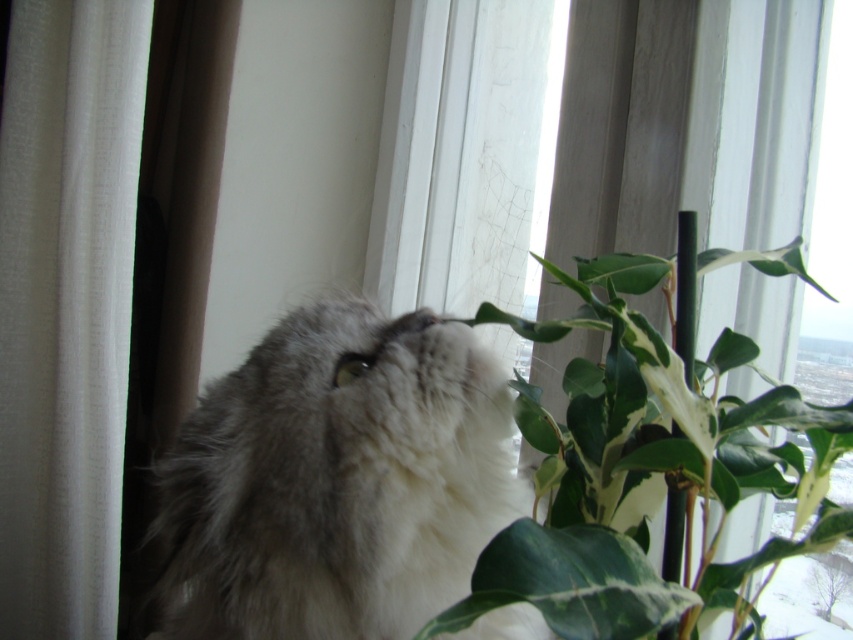
Does fuzzy fur cat at center have a smaller size compared to white sheer curtain at left?

Correct, fuzzy fur cat at center occupies less space than white sheer curtain at left.

Is point (281, 433) closer to camera compared to point (22, 152)?

Yes, it is.

Find the location of a particular element. fuzzy fur cat at center is located at coordinates (335, 481).

Between point (413, 516) and point (666, 548), which one is positioned behind?

Point (666, 548)

Can you confirm if fuzzy fur cat at center is positioned above green leafy plant at center?

Yes, fuzzy fur cat at center is above green leafy plant at center.

Locate an element on the screen. fuzzy fur cat at center is located at coordinates (335, 481).

Consider the image. Can you confirm if white sheer curtain at left is positioned below green leafy plant at center?

Incorrect, white sheer curtain at left is not positioned below green leafy plant at center.

Which is in front, point (129, 112) or point (546, 339)?

Positioned in front is point (546, 339).

The height and width of the screenshot is (640, 853). I want to click on white sheer curtain at left, so click(x=67, y=307).